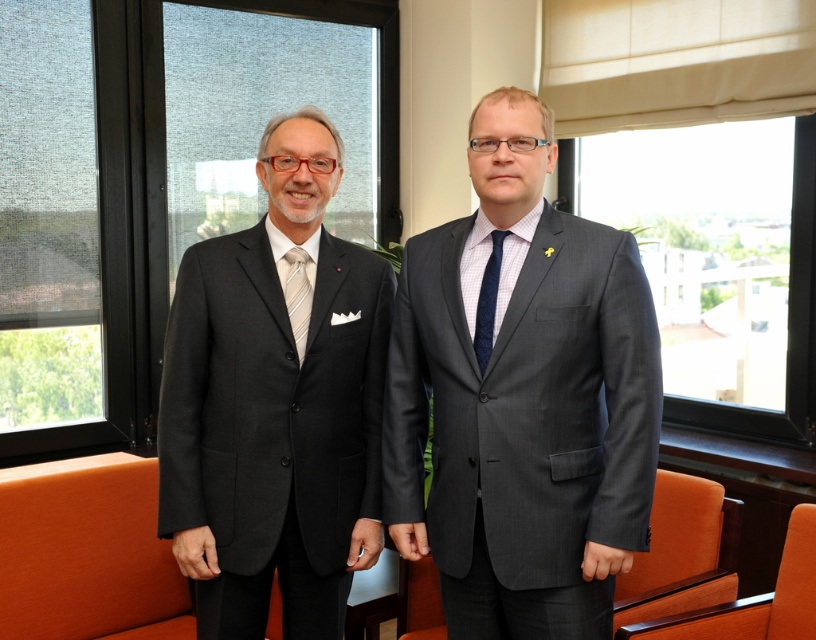
In the scene shown: You are a photographer setting up a shoot in this office. You need to position a light source so that it illuminates both the matte black suit at left and the dark blue textured tie at center. Based on their positions, where should you place the light source relative to the subjects?

The matte black suit at left is below the dark blue textured tie at center, so placing the light source above and slightly to the right of the subjects would ensure both areas receive adequate lighting.

You are an interior designer assessing the lighting in this office. You notice two transparent glass windows. Which one has a greater width, the transparent glass window at upper left or the transparent glass window at left?

The transparent glass window at upper left has a greater width than the transparent glass window at left according to the description.

You are an interior designer assessing the lighting in this office. You notice the transparent glass window at upper left and the transparent glass window at left. Which window allows more natural light into the room?

The transparent glass window at upper left allows more natural light into the room because it is bigger than the transparent glass window at left.